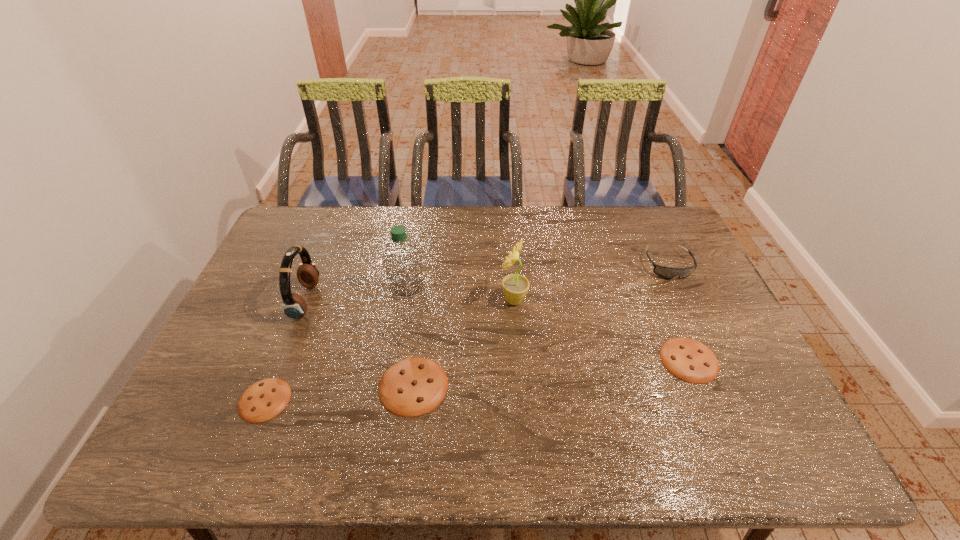
What are the coordinates of `free point located 0.050m on the right of the second cookie from left to right` in the screenshot? It's located at (468, 386).

Find the location of `blank space located 0.080m on the left of the sixth tallest object`. blank space located 0.080m on the left of the sixth tallest object is located at coordinates (631, 360).

The image size is (960, 540). In order to click on free space located 0.320m on the ear cup of the fifth shortest object in this screenshot , I will do `click(422, 301)`.

The width and height of the screenshot is (960, 540). In order to click on free region located on the face of the sunflower in this screenshot , I will do `click(414, 300)`.

You are a GUI agent. You are given a task and a screenshot of the screen. Output one action in this format:
    pyautogui.click(x=<x>, y=<y>)
    Task: Click on the vacant space situated on the face of the sunflower
    This screenshot has width=960, height=540.
    Given the screenshot: What is the action you would take?
    pyautogui.click(x=377, y=300)

Identify the location of free location located on the face of the sunflower. This screenshot has width=960, height=540. (437, 300).

Locate an element on the screen. vacant point located 0.370m on the lenses of the fourth tallest object is located at coordinates (723, 382).

Find the location of `vacant space situated 0.320m on the back of the water bottle`. vacant space situated 0.320m on the back of the water bottle is located at coordinates (419, 217).

This screenshot has width=960, height=540. In order to click on cookie that is at the left edge in this screenshot , I will do `click(265, 399)`.

The height and width of the screenshot is (540, 960). What are the coordinates of `headset that is at the left edge` in the screenshot? It's located at (294, 306).